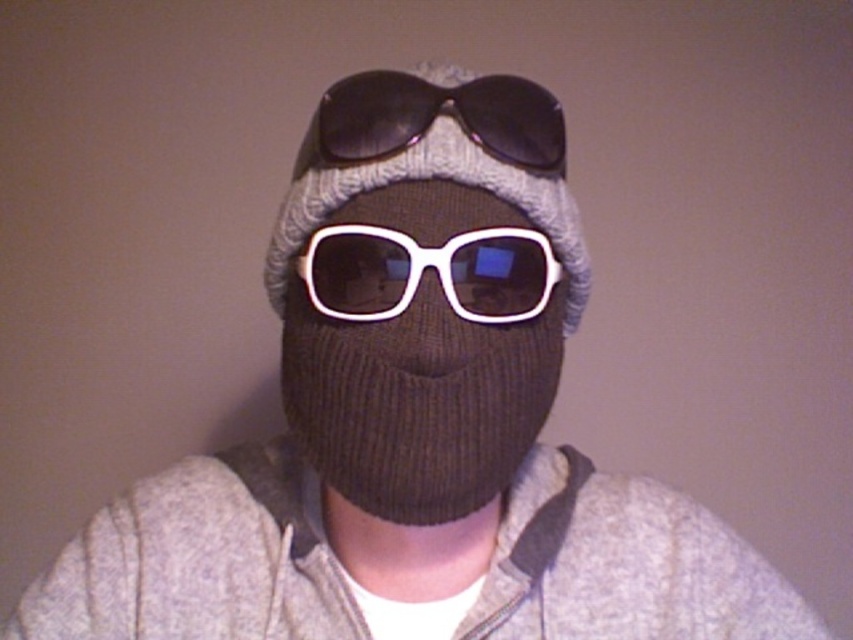
Question: Among these objects, which one is nearest to the camera?

Choices:
 (A) sunglasses at center
 (B) knitted gray hat at center

Answer: (B)

Question: Can you confirm if white matte sunglasses at center is smaller than knitted gray hat at center?

Choices:
 (A) yes
 (B) no

Answer: (A)

Question: Is white matte sunglasses at center to the left of knitted gray hat at center from the viewer's perspective?

Choices:
 (A) no
 (B) yes

Answer: (B)

Question: Which point is farther to the camera?

Choices:
 (A) white plastic sunglasses at center
 (B) knitted gray hat at center
 (C) white matte sunglasses at center

Answer: (B)

Question: Which object is the farthest from the knitted gray hat at center?

Choices:
 (A) white matte sunglasses at center
 (B) white plastic sunglasses at center

Answer: (A)

Question: Does white matte sunglasses at center have a greater width compared to knitted gray hat at center?

Choices:
 (A) yes
 (B) no

Answer: (B)